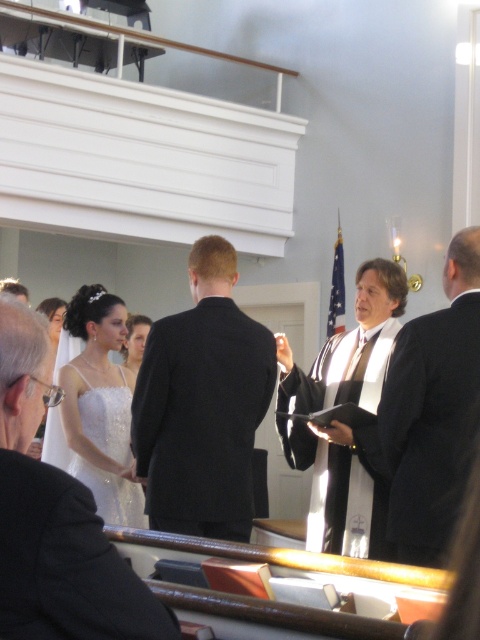
Question: Is black satin suit at center smaller than black silk robe at right?

Choices:
 (A) yes
 (B) no

Answer: (B)

Question: Does black silk robe at right appear on the right side of black suit at center?

Choices:
 (A) no
 (B) yes

Answer: (B)

Question: Which is farther from the black satin suit at center?

Choices:
 (A) shiny black suit at center
 (B) black suit at center
 (C) black silk robe at right
 (D) sequined satin dress at center

Answer: (A)

Question: From the image, what is the correct spatial relationship of black silk robe at right in relation to sequined satin dress at center?

Choices:
 (A) left
 (B) right

Answer: (B)

Question: Which object is closer to the camera taking this photo?

Choices:
 (A) black silk robe at right
 (B) matte white dress at center
 (C) sequined satin dress at center

Answer: (A)

Question: Which point is farther from the camera taking this photo?

Choices:
 (A) (103, 406)
 (B) (135, 337)
 (C) (13, 536)
 (D) (219, 333)

Answer: (B)